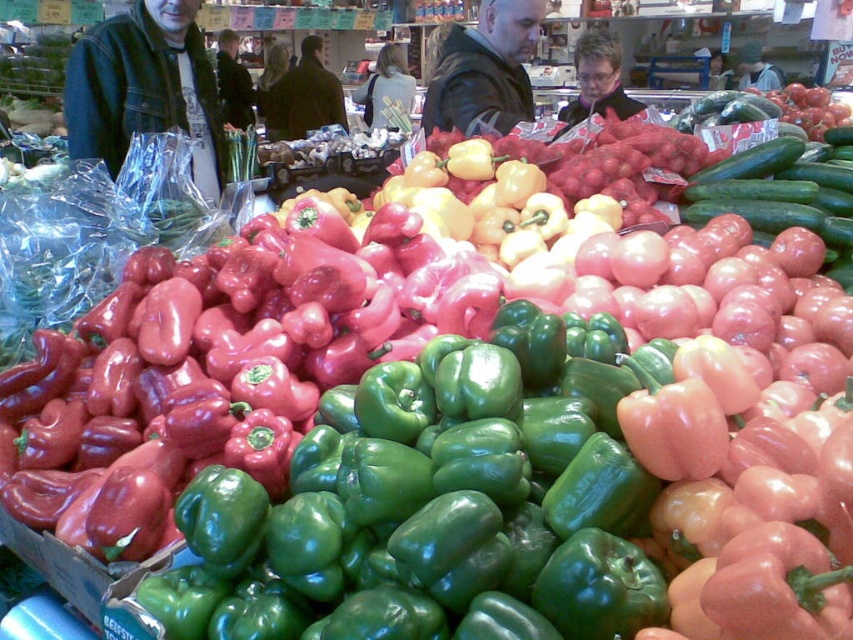
Can you confirm if dark brown jacket at center is bigger than dark blue denim jacket at upper left?

Yes.

Is dark brown jacket at center to the right of dark blue denim jacket at upper left from the viewer's perspective?

Yes, dark brown jacket at center is to the right of dark blue denim jacket at upper left.

Is point (283, 93) closer to viewer compared to point (236, 90)?

Yes.

The image size is (853, 640). Identify the location of dark brown jacket at center. (305, 97).

Between denim jacket at center and dark blue denim jacket at upper left, which one is positioned lower?

denim jacket at center

Can you confirm if denim jacket at center is smaller than dark blue denim jacket at upper left?

Incorrect, denim jacket at center is not smaller in size than dark blue denim jacket at upper left.

Is point (367, 102) farther from viewer compared to point (230, 104)?

Yes, point (367, 102) is farther from viewer.

Identify the location of denim jacket at center. (386, 88).

Which of these two, leather jacket at center or dark blue denim jacket at upper left, stands taller?

Standing taller between the two is dark blue denim jacket at upper left.

Find the location of a particular element. The width and height of the screenshot is (853, 640). leather jacket at center is located at coordinates (485, 70).

Which is in front, point (421, 122) or point (242, 99)?

Point (421, 122)

You are a GUI agent. You are given a task and a screenshot of the screen. Output one action in this format:
    pyautogui.click(x=<x>, y=<y>)
    Task: Click on the leather jacket at center
    
    Given the screenshot: What is the action you would take?
    pyautogui.click(x=485, y=70)